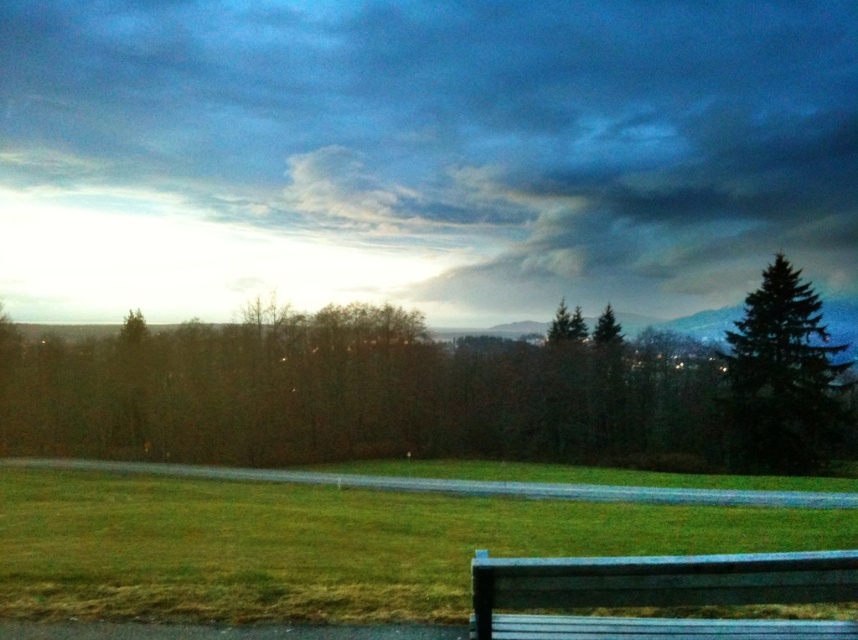
Can you confirm if green grass at lower left is positioned to the left of green matte tree at right?

Indeed, green grass at lower left is positioned on the left side of green matte tree at right.

Which is below, green grass at lower left or green matte tree at right?

green grass at lower left

Where is `green grass at lower left`? This screenshot has height=640, width=858. green grass at lower left is located at coordinates (323, 545).

Can you confirm if cloudy sky at upper center is positioned to the right of green grass at lower left?

Incorrect, cloudy sky at upper center is not on the right side of green grass at lower left.

Who is more distant from viewer, [825,96] or [202,557]?

The point [825,96] is more distant.

Which is behind, point (758, 212) or point (554, 525)?

The point (758, 212) is more distant.

You are a GUI agent. You are given a task and a screenshot of the screen. Output one action in this format:
    pyautogui.click(x=<x>, y=<y>)
    Task: Click on the cloudy sky at upper center
    The width and height of the screenshot is (858, 640).
    Given the screenshot: What is the action you would take?
    pyautogui.click(x=421, y=154)

Which is below, green matte tree at center or green matte tree at right?

green matte tree at center is lower down.

Is green matte tree at center positioned at the back of green matte tree at right?

That is True.

The width and height of the screenshot is (858, 640). Identify the location of green matte tree at center. (400, 401).

Where is `green matte tree at center`? The height and width of the screenshot is (640, 858). green matte tree at center is located at coordinates (400, 401).